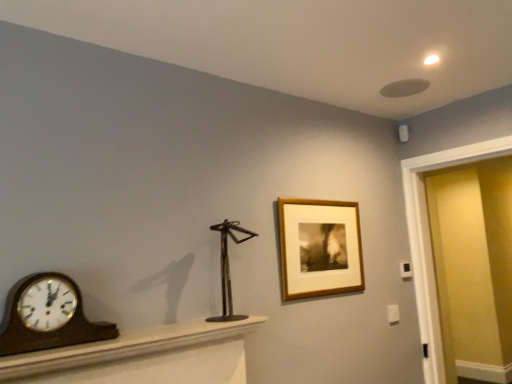
Question: Looking at their shapes, would you say wooden frame at upper right is wider or thinner than wooden polished clock at left?

Choices:
 (A) wide
 (B) thin

Answer: (B)

Question: From a real-world perspective, is wooden frame at upper right physically located above or below wooden polished clock at left?

Choices:
 (A) below
 (B) above

Answer: (B)

Question: Estimate the real-world distances between objects in this image. Which object is farther from the matte yellow door at right?

Choices:
 (A) wooden polished clock at left
 (B) wooden frame at upper right
 (C) brown wood mantel at lower left
 (D) metallic sculpture at center

Answer: (A)

Question: Considering the real-world distances, which object is farthest from the wooden frame at upper right?

Choices:
 (A) wooden polished clock at left
 (B) matte yellow door at right
 (C) metallic sculpture at center
 (D) brown wood mantel at lower left

Answer: (B)